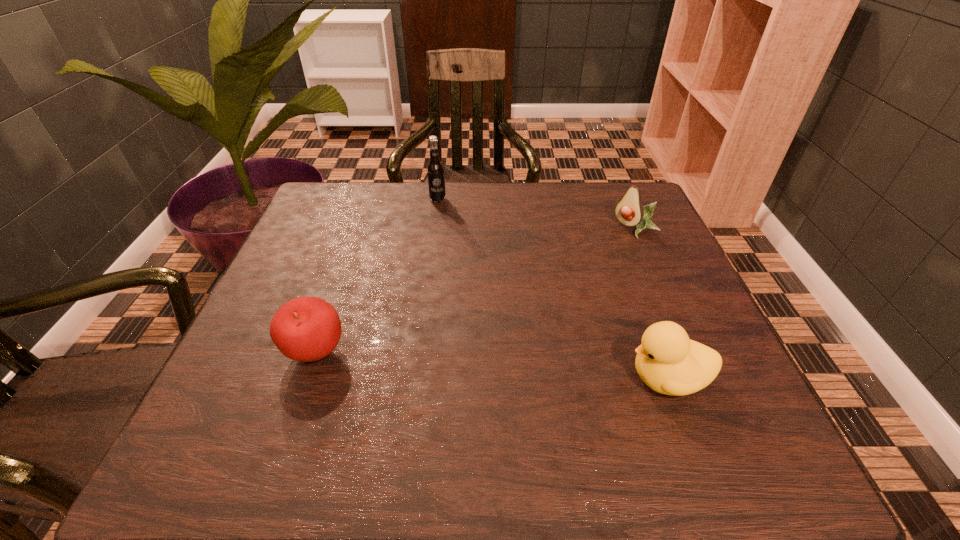
You are a GUI agent. You are given a task and a screenshot of the screen. Output one action in this format:
    pyautogui.click(x=<x>, y=<y>)
    Task: Click on the free space at the near left corner of the desktop
    
    Given the screenshot: What is the action you would take?
    pyautogui.click(x=219, y=413)

Where is `vacant region at the far right corner of the desktop`? The height and width of the screenshot is (540, 960). vacant region at the far right corner of the desktop is located at coordinates (613, 193).

I want to click on unoccupied position between the third nearest object and the root beer, so click(537, 214).

The image size is (960, 540). Identify the location of empty location between the third nearest object and the duck. (651, 303).

Image resolution: width=960 pixels, height=540 pixels. I want to click on vacant point located between the duck and the third object from right to left, so click(552, 289).

At what (x,y) coordinates should I click in order to perform the action: click on vacant space in between the avocado and the tallest object. Please return your answer as a coordinate pair (x, y). Looking at the image, I should click on (537, 214).

You are a GUI agent. You are given a task and a screenshot of the screen. Output one action in this format:
    pyautogui.click(x=<x>, y=<y>)
    Task: Click on the free area in between the duck and the farthest object
    The width and height of the screenshot is (960, 540).
    Given the screenshot: What is the action you would take?
    pyautogui.click(x=552, y=289)

The image size is (960, 540). I want to click on vacant area that lies between the avocado and the tallest object, so pyautogui.click(x=537, y=214).

Identify the location of free space between the leftmost object and the second farthest object. (475, 291).

Image resolution: width=960 pixels, height=540 pixels. In order to click on free space between the second object from left to right and the duck in this screenshot , I will do `click(552, 289)`.